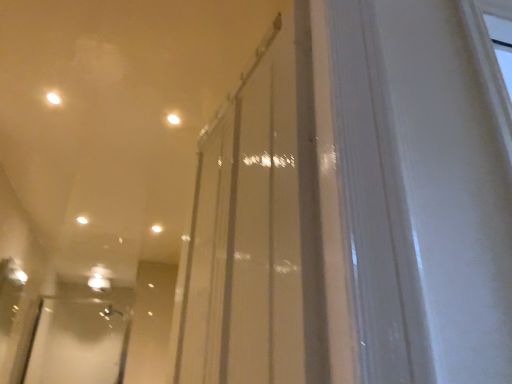
Question: Is transparent glass door at center placed right next to white glossy light at center, which is the third light from top to bottom?

Choices:
 (A) yes
 (B) no

Answer: (B)

Question: Is transparent glass door at center facing towards white glossy light at center, positioned as the first light in back-to-front order?

Choices:
 (A) yes
 (B) no

Answer: (B)

Question: Considering the relative sizes of transparent glass door at center and white glossy light at center, positioned as the first light in back-to-front order, in the image provided, is transparent glass door at center smaller than white glossy light at center, positioned as the first light in back-to-front order,?

Choices:
 (A) yes
 (B) no

Answer: (B)

Question: Would you say transparent glass door at center is outside white glossy light at center, the third light from the front?

Choices:
 (A) yes
 (B) no

Answer: (A)

Question: From a real-world perspective, is transparent glass door at center on top of white glossy light at center, arranged as the 2th light when viewed from the left?

Choices:
 (A) no
 (B) yes

Answer: (A)

Question: Is matte white light at upper center, positioned as the 1th light in front-to-back order, inside or outside of white glossy light at upper center, the second light in the top-to-bottom sequence?

Choices:
 (A) outside
 (B) inside

Answer: (A)

Question: In terms of size, does matte white light at upper center, which is the 3th light in bottom-to-top order, appear bigger or smaller than white glossy light at upper center, the second light in the top-to-bottom sequence?

Choices:
 (A) big
 (B) small

Answer: (B)

Question: Relative to white glossy light at upper center, which is counted as the 2th light, starting from the bottom, is matte white light at upper center, which is counted as the 1th light, starting from the right, in front or behind?

Choices:
 (A) front
 (B) behind

Answer: (A)

Question: Does point (173, 114) appear closer or farther from the camera than point (88, 221)?

Choices:
 (A) farther
 (B) closer

Answer: (B)

Question: In terms of width, does clear plastic screen door at lower left look wider or thinner when compared to transparent glass door at center?

Choices:
 (A) thin
 (B) wide

Answer: (A)

Question: From the image's perspective, relative to transparent glass door at center, is clear plastic screen door at lower left above or below?

Choices:
 (A) above
 (B) below

Answer: (B)

Question: Choose the correct answer: Is clear plastic screen door at lower left inside transparent glass door at center or outside it?

Choices:
 (A) inside
 (B) outside

Answer: (B)

Question: Relative to transparent glass door at center, is clear plastic screen door at lower left in front or behind?

Choices:
 (A) behind
 (B) front

Answer: (A)

Question: Considering the positions of matte white light at upper center, the 3th light in the back-to-front sequence, and clear plastic screen door at lower left in the image, is matte white light at upper center, the 3th light in the back-to-front sequence, taller or shorter than clear plastic screen door at lower left?

Choices:
 (A) short
 (B) tall

Answer: (A)

Question: In terms of width, does matte white light at upper center, which is counted as the 1th light, starting from the right, look wider or thinner when compared to clear plastic screen door at lower left?

Choices:
 (A) thin
 (B) wide

Answer: (A)